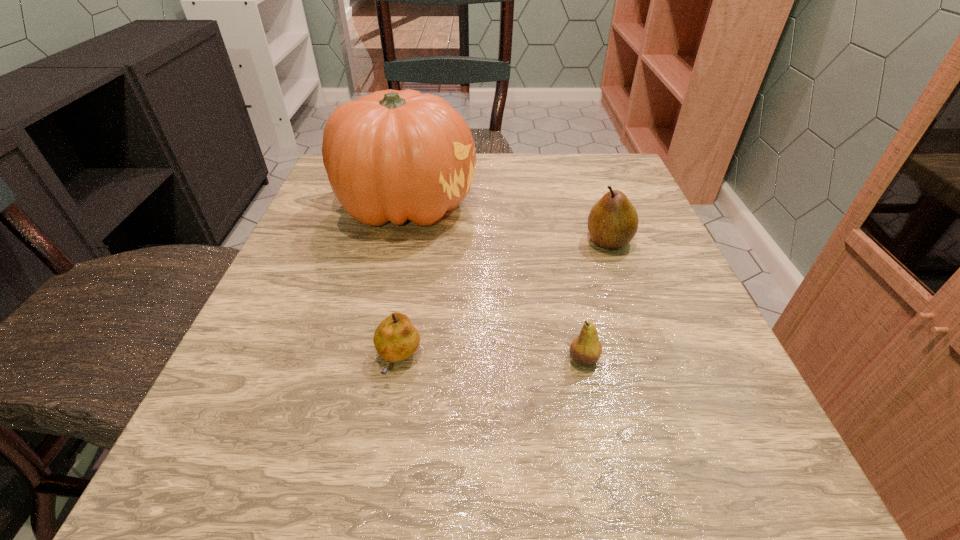
Identify the location of free area in between the pumpkin and the rightmost pear. (508, 223).

The width and height of the screenshot is (960, 540). Find the location of `empty space that is in between the shortest pear and the tallest object`. empty space that is in between the shortest pear and the tallest object is located at coordinates (402, 283).

The width and height of the screenshot is (960, 540). In order to click on vacant area that lies between the second pear from left to right and the shortest pear in this screenshot , I will do `click(491, 360)`.

The width and height of the screenshot is (960, 540). I want to click on free spot between the second pear from right to left and the third shortest object, so click(x=596, y=300).

You are a GUI agent. You are given a task and a screenshot of the screen. Output one action in this format:
    pyautogui.click(x=<x>, y=<y>)
    Task: Click on the free space between the tallest object and the second pear from left to right
    The image size is (960, 540).
    Given the screenshot: What is the action you would take?
    pyautogui.click(x=495, y=282)

Identify the location of vacant point located between the third shortest object and the tallest object. (508, 223).

Find the location of a particular element. The height and width of the screenshot is (540, 960). vacant region between the tallest object and the leftmost pear is located at coordinates (402, 283).

You are a GUI agent. You are given a task and a screenshot of the screen. Output one action in this format:
    pyautogui.click(x=<x>, y=<y>)
    Task: Click on the vacant space that's between the third object from left to right and the tallest object
    This screenshot has height=540, width=960.
    Given the screenshot: What is the action you would take?
    pyautogui.click(x=495, y=282)

Identify the location of vacant space that's between the tallest pear and the second object from right to left. The width and height of the screenshot is (960, 540). (596, 300).

Where is `vacant region between the rightmost pear and the tallest object`? The image size is (960, 540). vacant region between the rightmost pear and the tallest object is located at coordinates (508, 223).